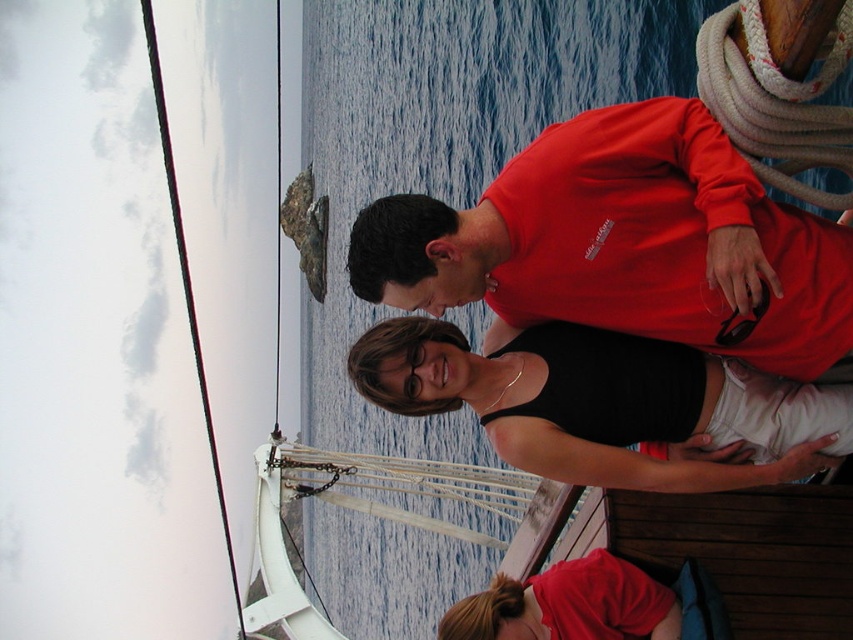
Question: Does matte red shirt at center lie behind black matte tank top at center?

Choices:
 (A) yes
 (B) no

Answer: (B)

Question: Which point is farther from the camera taking this photo?

Choices:
 (A) (718, 381)
 (B) (614, 224)

Answer: (A)

Question: Does matte red shirt at center appear on the left side of black matte tank top at center?

Choices:
 (A) no
 (B) yes

Answer: (A)

Question: Is matte red shirt at center to the left of black matte tank top at center from the viewer's perspective?

Choices:
 (A) no
 (B) yes

Answer: (A)

Question: Among these points, which one is farthest from the camera?

Choices:
 (A) (683, 211)
 (B) (589, 432)

Answer: (B)